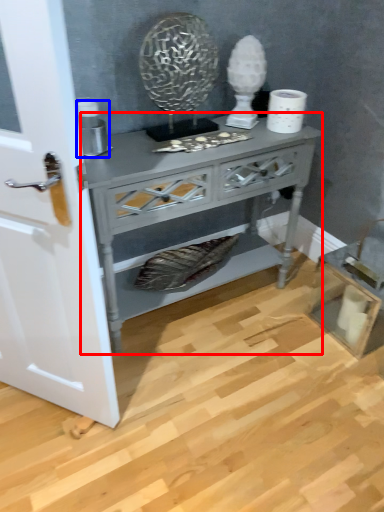
Question: Which of the following is the farthest to the observer, nightstand (highlighted by a red box) or appliance (highlighted by a blue box)?

Choices:
 (A) nightstand
 (B) appliance

Answer: (B)